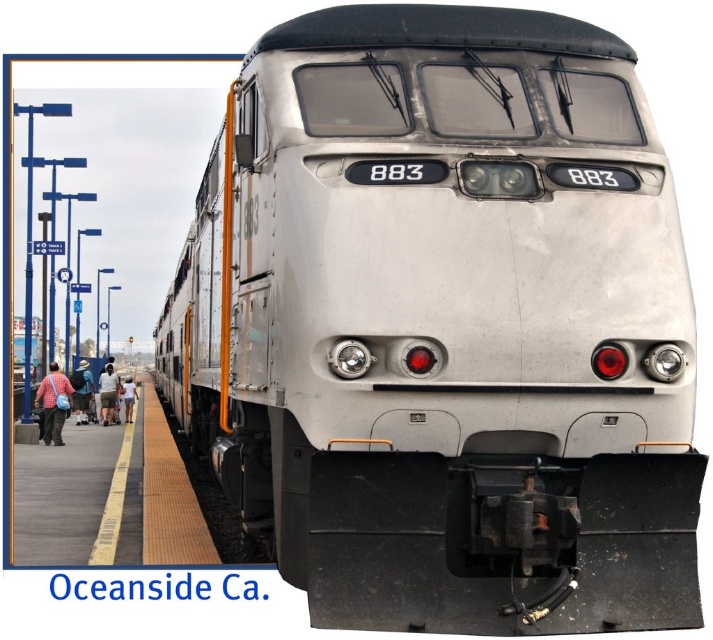
Question: Considering the relative positions of checkered shirt fabric at lower left and light blue denim shorts at lower left in the image provided, where is checkered shirt fabric at lower left located with respect to light blue denim shorts at lower left?

Choices:
 (A) right
 (B) left

Answer: (A)

Question: Is checkered shirt fabric at lower left closer to the viewer compared to light brown fabric pants at lower left?

Choices:
 (A) yes
 (B) no

Answer: (A)

Question: Observing the image, what is the correct spatial positioning of checkered shirt fabric at lower left in reference to denim shorts at left?

Choices:
 (A) left
 (B) right

Answer: (B)

Question: Which object is farther from the camera taking this photo?

Choices:
 (A) checkered shirt fabric at lower left
 (B) denim shorts at left
 (C) light blue denim shorts at lower left
 (D) light brown fabric pants at lower left

Answer: (D)

Question: Which object is positioned farthest from the denim shorts at left?

Choices:
 (A) light blue denim shorts at lower left
 (B) checkered shirt fabric at lower left

Answer: (B)

Question: Estimate the real-world distances between objects in this image. Which object is closer to the light brown fabric pants at lower left?

Choices:
 (A) checkered shirt fabric at lower left
 (B) denim shorts at left

Answer: (A)